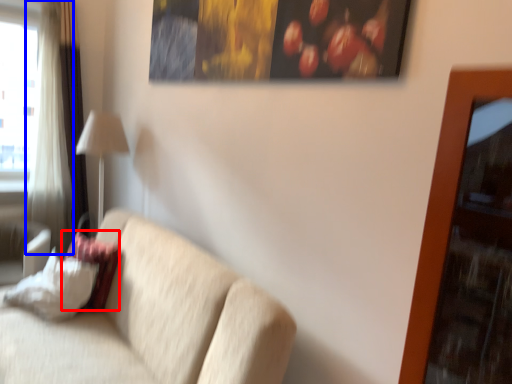
Question: Among these objects, which one is nearest to the camera, pillow (highlighted by a red box) or curtain (highlighted by a blue box)?

Choices:
 (A) pillow
 (B) curtain

Answer: (A)